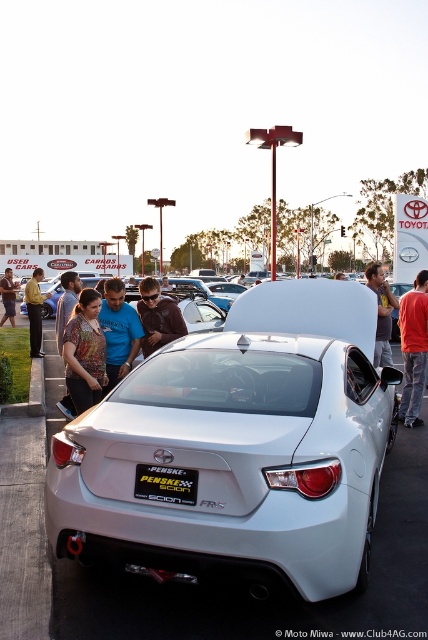
Question: Which point is farther to the camera?

Choices:
 (A) matte black shirt at center
 (B) black plastic license plate at rear

Answer: (A)

Question: Which of the following is the farthest from the observer?

Choices:
 (A) matte black jacket at lower left
 (B) satin white sedan at center
 (C) brown leather jacket at center

Answer: (A)

Question: Does black plastic license plate at rear have a smaller size compared to yellow shirt at left?

Choices:
 (A) no
 (B) yes

Answer: (B)

Question: Can you confirm if satin white sedan at center is positioned above matte brown shirt at center?

Choices:
 (A) yes
 (B) no

Answer: (B)

Question: Which of the following is the closest to the observer?

Choices:
 (A) yellow shirt at left
 (B) red shirt at lower right
 (C) brown leather jacket at center

Answer: (C)

Question: Where is matte black jacket at lower left located in relation to matte brown leather jacket at center in the image?

Choices:
 (A) right
 (B) left

Answer: (B)